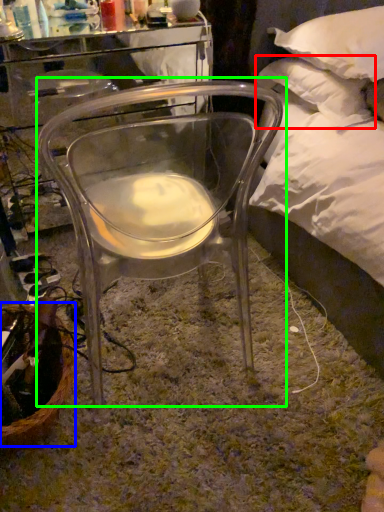
Question: Which is nearer to the pillow (highlighted by a red box)? basket (highlighted by a blue box) or chair (highlighted by a green box).

Choices:
 (A) basket
 (B) chair

Answer: (B)